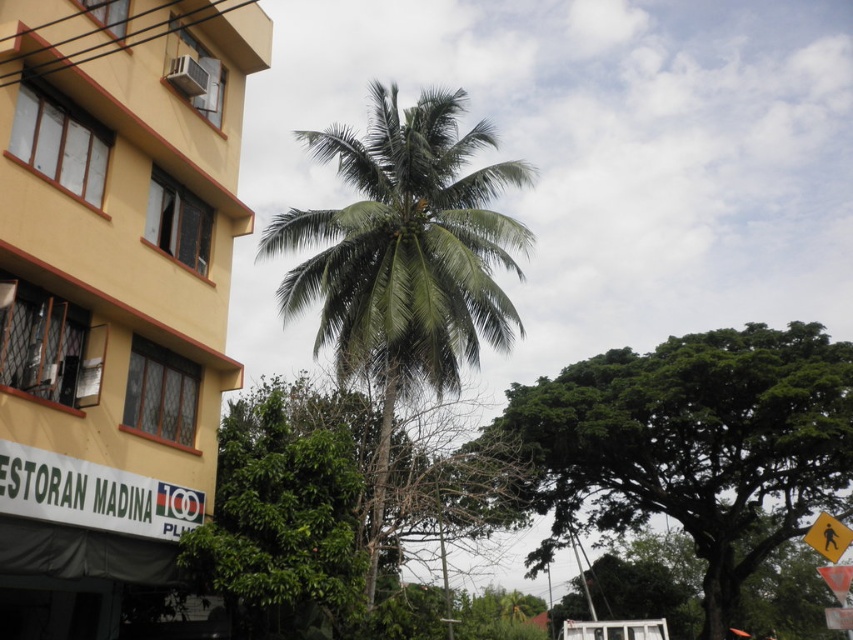
Question: Which is nearer to the yellow reflective pedestrian crossing sign at lower right?

Choices:
 (A) green leafy palm tree at center
 (B) yellow matte building at left

Answer: (B)

Question: Is green leafy tree at center to the right of yellow reflective pedestrian crossing sign at lower right from the viewer's perspective?

Choices:
 (A) yes
 (B) no

Answer: (A)

Question: Is green leafy tree at center behind yellow reflective pedestrian crossing sign at lower right?

Choices:
 (A) yes
 (B) no

Answer: (A)

Question: Is yellow matte building at left positioned at the back of green leafy tree at center?

Choices:
 (A) yes
 (B) no

Answer: (B)

Question: Which object appears farthest from the camera in this image?

Choices:
 (A) green leafy tree at center
 (B) yellow matte building at left
 (C) yellow reflective pedestrian crossing sign at lower right
 (D) green leafy palm tree at center

Answer: (A)

Question: Which of these objects is positioned closest to the yellow reflective pedestrian crossing sign at lower right?

Choices:
 (A) green leafy palm tree at center
 (B) yellow matte building at left
 (C) green leafy tree at center

Answer: (B)